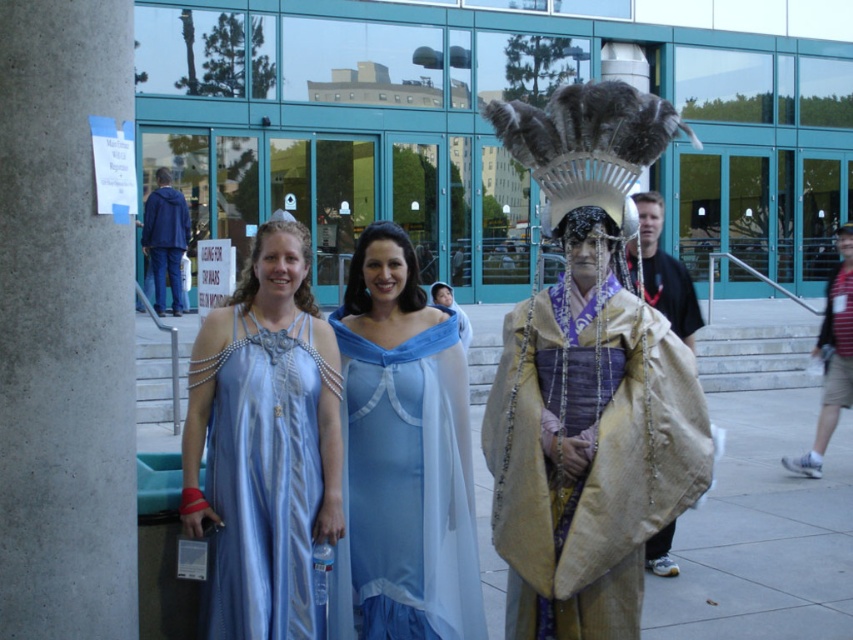
Question: Can you confirm if gold textured cape at center is bigger than beige fabric cape at center?

Choices:
 (A) yes
 (B) no

Answer: (A)

Question: Considering the relative positions of gold textured cape at center and beige fabric cape at center in the image provided, where is gold textured cape at center located with respect to beige fabric cape at center?

Choices:
 (A) left
 (B) right

Answer: (A)

Question: Which of the following is the farthest from the observer?

Choices:
 (A) concrete pillar at left
 (B) gold textured cape at center

Answer: (B)

Question: Does concrete pillar at left appear over matte blue dress at center?

Choices:
 (A) no
 (B) yes

Answer: (B)

Question: Which point is closer to the camera?

Choices:
 (A) (695, 300)
 (B) (363, 627)
 (C) (605, 433)

Answer: (C)

Question: Which point is farther to the camera?

Choices:
 (A) (155, 244)
 (B) (827, 353)
 (C) (247, 403)

Answer: (A)